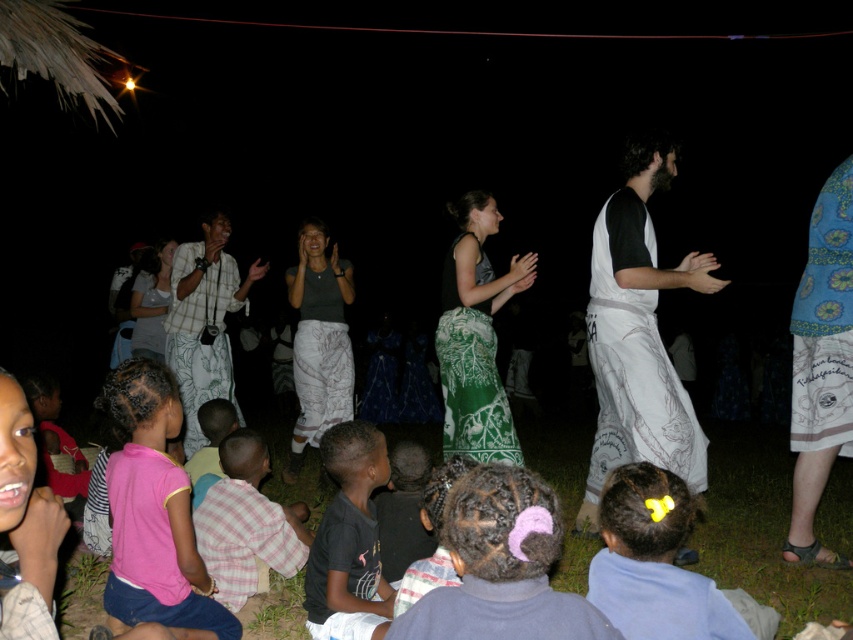
Who is higher up, pink fabric at lower left or pink plaid shirt at lower left?

pink fabric at lower left is above.

Between point (157, 442) and point (224, 541), which one is positioned behind?

Positioned behind is point (224, 541).

In order to click on pink fabric at lower left in this screenshot , I will do `click(154, 513)`.

Who is higher up, black cotton shirt at lower center or plaid fabric shirt at center?

plaid fabric shirt at center is higher up.

Does black cotton shirt at lower center have a smaller size compared to plaid fabric shirt at center?

Correct, black cotton shirt at lower center occupies less space than plaid fabric shirt at center.

Is point (335, 609) farther from camera compared to point (251, 284)?

No, it is in front of (251, 284).

Find the location of a particular element. This screenshot has height=640, width=853. black cotton shirt at lower center is located at coordinates (349, 532).

This screenshot has width=853, height=640. In order to click on pink plaid shirt at lower left in this screenshot , I will do `click(247, 522)`.

What do you see at coordinates (247, 522) in the screenshot? This screenshot has width=853, height=640. I see `pink plaid shirt at lower left` at bounding box center [247, 522].

Find the location of a particular element. This screenshot has width=853, height=640. pink plaid shirt at lower left is located at coordinates (247, 522).